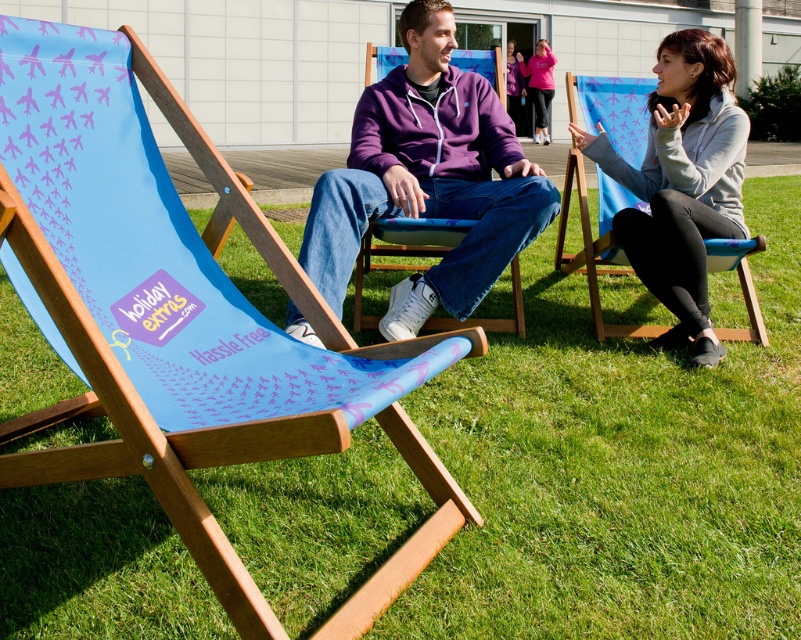
You are standing in the outdoor scene and want to take a photo of the purple fleece jacket at center. However, the blue wood beach chair at center is blocking your view. Is there a way to move the chair to get a clear shot?

The blue wood beach chair at center is in front of the purple fleece jacket at center, so moving the chair backward or to the side would allow you to see the purple fleece jacket at center clearly.